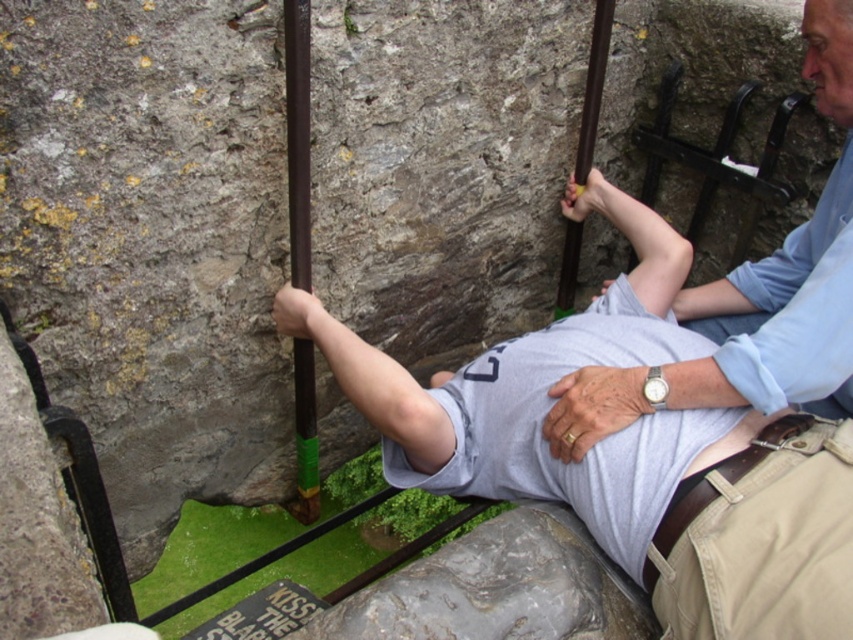
Describe the element at coordinates (798, 312) in the screenshot. I see `light blue cotton shirt at upper right` at that location.

Where is `light blue cotton shirt at upper right`? The image size is (853, 640). light blue cotton shirt at upper right is located at coordinates (798, 312).

In the scene shown: Is tan canvas pants at lower right to the right of green plastic pole at center from the viewer's perspective?

Indeed, tan canvas pants at lower right is positioned on the right side of green plastic pole at center.

Locate an element on the screen. tan canvas pants at lower right is located at coordinates (759, 540).

You are a GUI agent. You are given a task and a screenshot of the screen. Output one action in this format:
    pyautogui.click(x=<x>, y=<y>)
    Task: Click on the tan canvas pants at lower right
    Image resolution: width=853 pixels, height=640 pixels.
    Given the screenshot: What is the action you would take?
    pyautogui.click(x=759, y=540)

Who is more forward, (704,600) or (753,310)?

Positioned in front is point (704,600).

Can you confirm if tan canvas pants at lower right is thinner than light blue cotton shirt at upper right?

In fact, tan canvas pants at lower right might be wider than light blue cotton shirt at upper right.

Who is more distant from viewer, (x=643, y=580) or (x=817, y=404)?

Point (x=817, y=404)

Where is `tan canvas pants at lower right`? tan canvas pants at lower right is located at coordinates 759,540.